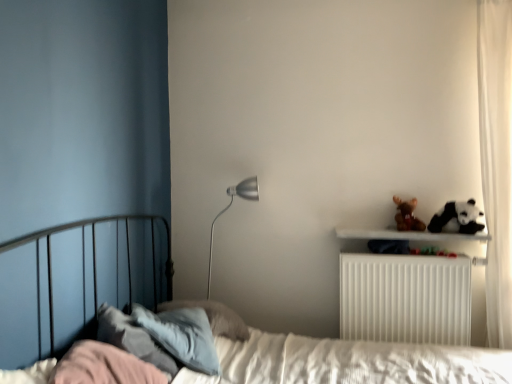
Question: Does white plastic radiator at upper right turn towards white sheer curtain at right?

Choices:
 (A) yes
 (B) no

Answer: (B)

Question: From the image's perspective, is white plastic radiator at upper right beneath white sheer curtain at right?

Choices:
 (A) no
 (B) yes

Answer: (B)

Question: Considering the relative positions of white plastic radiator at upper right and white sheer curtain at right in the image provided, is white plastic radiator at upper right to the left of white sheer curtain at right from the viewer's perspective?

Choices:
 (A) yes
 (B) no

Answer: (A)

Question: Is the depth of white plastic radiator at upper right greater than that of white sheer curtain at right?

Choices:
 (A) no
 (B) yes

Answer: (B)

Question: Can you confirm if white plastic radiator at upper right is shorter than white sheer curtain at right?

Choices:
 (A) no
 (B) yes

Answer: (B)

Question: Is there a large distance between white plastic radiator at upper right and white sheer curtain at right?

Choices:
 (A) yes
 (B) no

Answer: (B)

Question: Is silver metallic floor lamp at center surrounded by white plastic radiator at upper right?

Choices:
 (A) no
 (B) yes

Answer: (A)

Question: Does white plastic radiator at upper right appear on the right side of silver metallic floor lamp at center?

Choices:
 (A) yes
 (B) no

Answer: (A)

Question: From the image's perspective, is white plastic radiator at upper right located beneath silver metallic floor lamp at center?

Choices:
 (A) no
 (B) yes

Answer: (B)

Question: Is white plastic radiator at upper right turned away from silver metallic floor lamp at center?

Choices:
 (A) yes
 (B) no

Answer: (B)

Question: Is white plastic radiator at upper right thinner than silver metallic floor lamp at center?

Choices:
 (A) no
 (B) yes

Answer: (A)

Question: Can you confirm if white plastic radiator at upper right is positioned to the left of silver metallic floor lamp at center?

Choices:
 (A) yes
 (B) no

Answer: (B)

Question: From a real-world perspective, is black and white plush panda at upper right physically above silver metallic floor lamp at center?

Choices:
 (A) yes
 (B) no

Answer: (A)